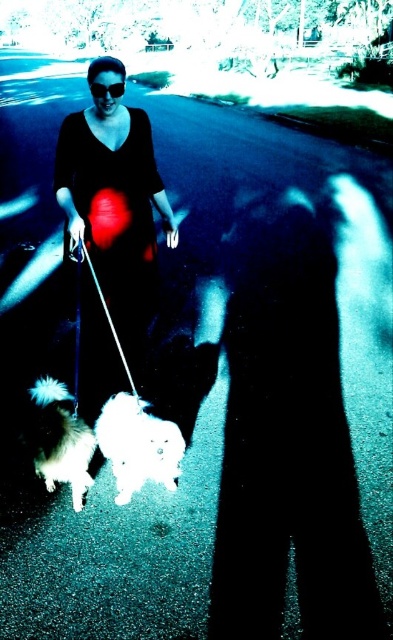
In the scene shown: Is matte black dress at center behind black matte goggles at upper center?

No, it is not.

Locate an element on the screen. The image size is (393, 640). matte black dress at center is located at coordinates (113, 205).

Which is behind, point (128, 413) or point (121, 93)?

The point (121, 93) is more distant.

Who is positioned more to the right, white fluffy dog at lower left or black matte goggles at upper center?

Positioned to the right is white fluffy dog at lower left.

Is point (97, 433) in front of point (99, 97)?

No, it is behind (99, 97).

The width and height of the screenshot is (393, 640). In order to click on white fluffy dog at lower left in this screenshot , I will do `click(137, 445)`.

Does matte black dress at center have a larger size compared to fluffy white dog at lower left?

Correct, matte black dress at center is larger in size than fluffy white dog at lower left.

What are the coordinates of `matte black dress at center` in the screenshot? It's located at (113, 205).